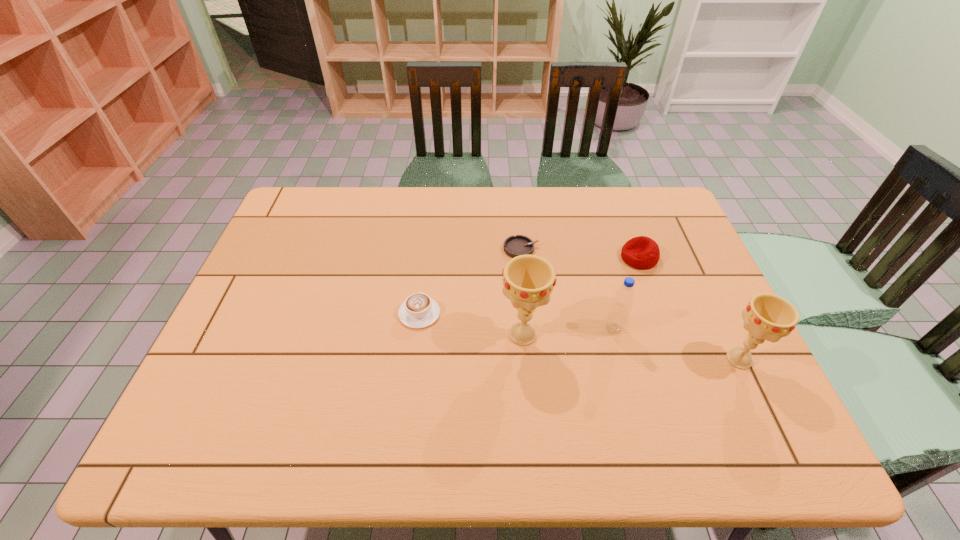
Where is `vacant space situated on the left of the tallest object`? The image size is (960, 540). vacant space situated on the left of the tallest object is located at coordinates (464, 335).

The height and width of the screenshot is (540, 960). What are the coordinates of `blank space located on the back of the shorter chalice` in the screenshot? It's located at (684, 246).

Where is `vacant region located on the front of the ashtray`? vacant region located on the front of the ashtray is located at coordinates (531, 355).

In order to click on vacant space located 0.060m on the seat area of the fourth tallest object in this screenshot , I will do `click(601, 258)`.

At what (x,y) coordinates should I click in order to perform the action: click on free spot located 0.250m on the seat area of the fourth tallest object. Please return your answer as a coordinate pair (x, y). The width and height of the screenshot is (960, 540). Looking at the image, I should click on (537, 258).

You are a GUI agent. You are given a task and a screenshot of the screen. Output one action in this format:
    pyautogui.click(x=<x>, y=<y>)
    Task: Click on the free space located on the seat area of the fourth tallest object
    
    Given the screenshot: What is the action you would take?
    pyautogui.click(x=527, y=258)

Locate an element on the screen. vacant space located 0.190m on the front of the water bottle is located at coordinates (634, 405).

Locate an element on the screen. The image size is (960, 540). free region located with the handle on the right side of the cappuccino is located at coordinates (427, 253).

Identify the location of vacant space located with the handle on the right side of the cappuccino. (425, 267).

Find the location of a particular element. This screenshot has width=960, height=540. free space located with the handle on the right side of the cappuccino is located at coordinates (427, 248).